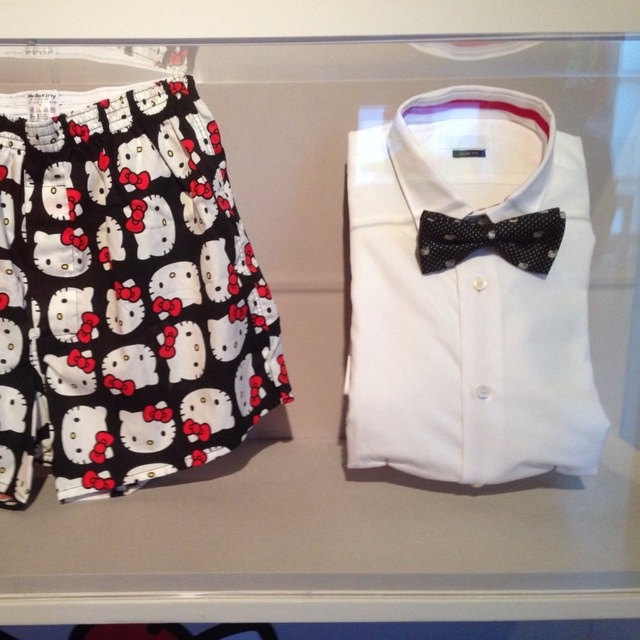
Question: Is white cotton dress shirt at center positioned at the back of black dotted bow tie at center?

Choices:
 (A) yes
 (B) no

Answer: (B)

Question: Which point appears closest to the camera in this image?

Choices:
 (A) (560, 332)
 (B) (529, 236)
 (C) (64, 353)

Answer: (B)

Question: Does printed cotton shorts at left appear on the right side of white cotton dress shirt at center?

Choices:
 (A) yes
 (B) no

Answer: (B)

Question: Considering the real-world distances, which object is farthest from the white cotton dress shirt at center?

Choices:
 (A) printed cotton shorts at left
 (B) black dotted bow tie at center

Answer: (A)

Question: Does printed cotton shorts at left have a larger size compared to black dotted bow tie at center?

Choices:
 (A) yes
 (B) no

Answer: (A)

Question: Among these points, which one is farthest from the camera?

Choices:
 (A) [554, 308]
 (B) [552, 250]

Answer: (A)